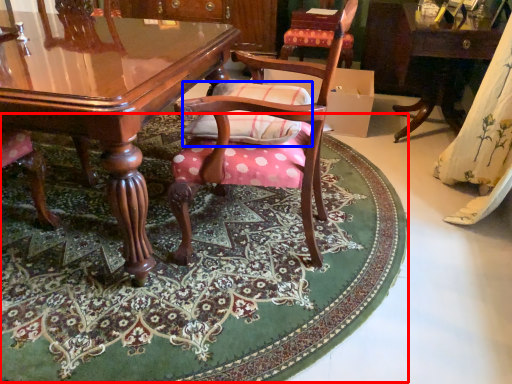
Question: Which point is closer to the camera, mat (highlighted by a red box) or pillow (highlighted by a blue box)?

Choices:
 (A) mat
 (B) pillow

Answer: (A)